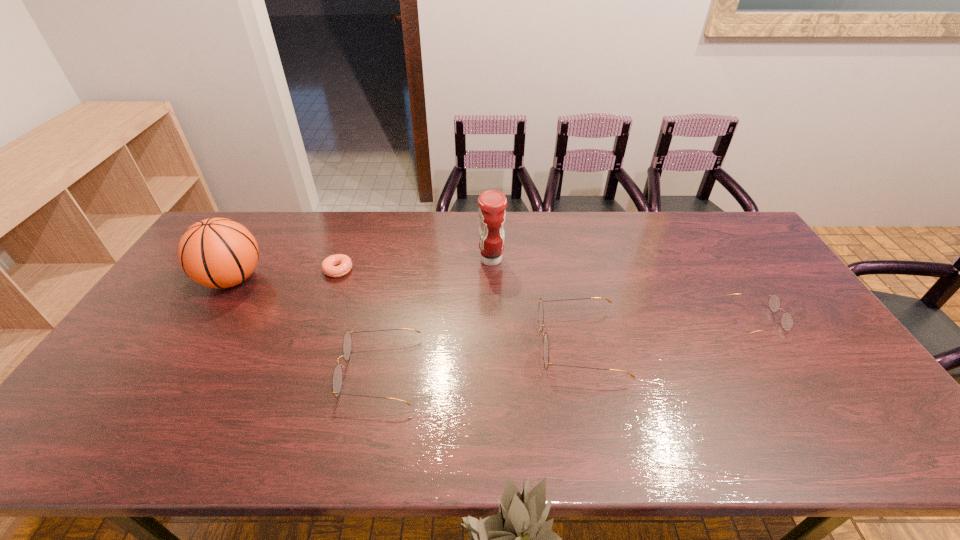
This screenshot has height=540, width=960. I want to click on object at the left edge, so click(x=217, y=252).

This screenshot has width=960, height=540. I want to click on object at the right edge, so pyautogui.click(x=787, y=321).

Identify the location of vacant position at the far edge of the desktop. (546, 236).

In the image, there is a desktop. Where is `vacant region at the near edge`? The height and width of the screenshot is (540, 960). vacant region at the near edge is located at coordinates (686, 380).

You are a GUI agent. You are given a task and a screenshot of the screen. Output one action in this format:
    pyautogui.click(x=<x>, y=<y>)
    Task: Click on the vacant space at the left edge
    The image size is (960, 540).
    Given the screenshot: What is the action you would take?
    pyautogui.click(x=120, y=370)

Identify the location of vacant space at the right edge of the desktop. (785, 347).

The height and width of the screenshot is (540, 960). Find the location of `free space at the far right corner of the desktop`. free space at the far right corner of the desktop is located at coordinates (694, 215).

Find the location of `free space between the shortest spectacles and the basketball`. free space between the shortest spectacles and the basketball is located at coordinates (494, 299).

Identify the location of empty space that is in between the condiment and the third shortest object. This screenshot has height=540, width=960. (436, 316).

The width and height of the screenshot is (960, 540). I want to click on free space that is in between the shortest spectacles and the leftmost object, so click(494, 299).